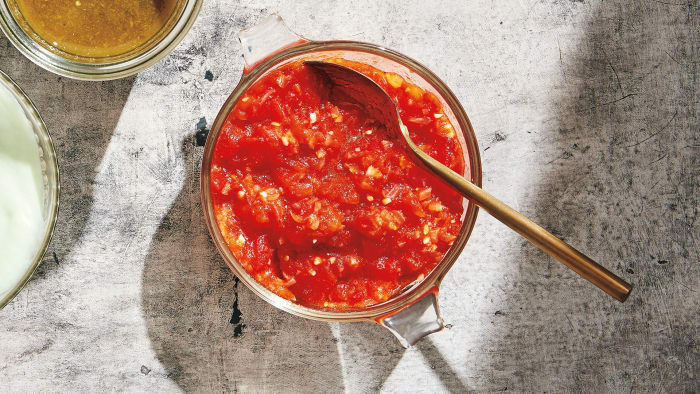
Locate an element on the screen. bowl is located at coordinates (97, 68), (206, 212).